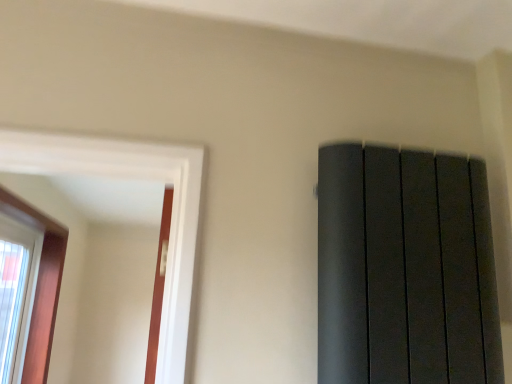
Consider the image. In order to face clear glass window at left, the 2th window positioned from the right, should I rotate leftwards or rightwards?

Rotate left and turn 30.486 degrees.

In order to click on clear glass window at left, the first window when ordered from left to right in this screenshot , I will do `click(16, 293)`.

The width and height of the screenshot is (512, 384). Describe the element at coordinates (16, 293) in the screenshot. I see `clear glass window at left, the first window when ordered from left to right` at that location.

Where is `wooden frame window at left, which ranks as the second window in left-to-right order`? wooden frame window at left, which ranks as the second window in left-to-right order is located at coordinates (41, 287).

What is the approximate width of wooden frame window at left, positioned as the 1th window in right-to-left order?

20.16 centimeters.

This screenshot has height=384, width=512. Describe the element at coordinates (41, 287) in the screenshot. I see `wooden frame window at left, positioned as the 1th window in right-to-left order` at that location.

The height and width of the screenshot is (384, 512). Identify the location of clear glass window at left, the 2th window positioned from the right. (16, 293).

Based on their positions, is clear glass window at left, the first window when ordered from left to right, located to the left or right of wooden frame window at left, positioned as the 1th window in right-to-left order?

In the image, clear glass window at left, the first window when ordered from left to right, appears on the left side of wooden frame window at left, positioned as the 1th window in right-to-left order.

Which is behind, clear glass window at left, the 2th window positioned from the right, or wooden frame window at left, which ranks as the second window in left-to-right order?

Answer: clear glass window at left, the 2th window positioned from the right, is further from the camera.

Considering the positions of point (17, 352) and point (29, 361), is point (17, 352) closer or farther from the camera than point (29, 361)?

Point (17, 352) is closer to the camera than point (29, 361).

From the image's perspective, is clear glass window at left, the 2th window positioned from the right, over wooden frame window at left, positioned as the 1th window in right-to-left order?

A: No, from the image's perspective, clear glass window at left, the 2th window positioned from the right, is not over wooden frame window at left, positioned as the 1th window in right-to-left order.

From a real-world perspective, is clear glass window at left, the 2th window positioned from the right, positioned under wooden frame window at left, which ranks as the second window in left-to-right order, based on gravity?

Yes, from a real-world perspective, clear glass window at left, the 2th window positioned from the right, is beneath wooden frame window at left, which ranks as the second window in left-to-right order.

Considering the sizes of objects clear glass window at left, the first window when ordered from left to right, and wooden frame window at left, positioned as the 1th window in right-to-left order, in the image provided, who is wider, clear glass window at left, the first window when ordered from left to right, or wooden frame window at left, positioned as the 1th window in right-to-left order,?

wooden frame window at left, positioned as the 1th window in right-to-left order, is wider.

Can you confirm if clear glass window at left, the first window when ordered from left to right, is shorter than wooden frame window at left, positioned as the 1th window in right-to-left order?

Correct, clear glass window at left, the first window when ordered from left to right, is not as tall as wooden frame window at left, positioned as the 1th window in right-to-left order.

Is clear glass window at left, the first window when ordered from left to right, bigger or smaller than wooden frame window at left, which ranks as the second window in left-to-right order?

clear glass window at left, the first window when ordered from left to right, is smaller than wooden frame window at left, which ranks as the second window in left-to-right order.

Is clear glass window at left, the 2th window positioned from the right, spatially inside wooden frame window at left, positioned as the 1th window in right-to-left order, or outside of it?

clear glass window at left, the 2th window positioned from the right, cannot be found inside wooden frame window at left, positioned as the 1th window in right-to-left order.

Is clear glass window at left, the first window when ordered from left to right, beside wooden frame window at left, positioned as the 1th window in right-to-left order?

No, clear glass window at left, the first window when ordered from left to right, is not making contact with wooden frame window at left, positioned as the 1th window in right-to-left order.

Is clear glass window at left, the 2th window positioned from the right, looking in the opposite direction of wooden frame window at left, which ranks as the second window in left-to-right order?

Yes, clear glass window at left, the 2th window positioned from the right, is facing away from wooden frame window at left, which ranks as the second window in left-to-right order.

Identify the location of window lying in front of the clear glass window at left, the first window when ordered from left to right. (41, 287).

Which is more to the left, wooden frame window at left, which ranks as the second window in left-to-right order, or clear glass window at left, the first window when ordered from left to right?

From the viewer's perspective, clear glass window at left, the first window when ordered from left to right, appears more on the left side.

Based on the photo, is wooden frame window at left, positioned as the 1th window in right-to-left order, in front of or behind clear glass window at left, the first window when ordered from left to right, in the image?

Visually, wooden frame window at left, positioned as the 1th window in right-to-left order, is located in front of clear glass window at left, the first window when ordered from left to right.

Considering the positions of points (35, 338) and (25, 324), is point (35, 338) closer to camera compared to point (25, 324)?

No, (35, 338) is further to viewer.

From the image's perspective, is wooden frame window at left, which ranks as the second window in left-to-right order, below clear glass window at left, the first window when ordered from left to right?

No, from the image's perspective, wooden frame window at left, which ranks as the second window in left-to-right order, is not below clear glass window at left, the first window when ordered from left to right.

From a real-world perspective, which object rests below the other?

From a 3D spatial view, clear glass window at left, the 2th window positioned from the right, is below.

Does wooden frame window at left, which ranks as the second window in left-to-right order, have a greater width compared to clear glass window at left, the 2th window positioned from the right?

Yes, wooden frame window at left, which ranks as the second window in left-to-right order, is wider than clear glass window at left, the 2th window positioned from the right.

Can you confirm if wooden frame window at left, which ranks as the second window in left-to-right order, is taller than clear glass window at left, the first window when ordered from left to right?

Correct, wooden frame window at left, which ranks as the second window in left-to-right order, is much taller as clear glass window at left, the first window when ordered from left to right.

Looking at this image, considering the relative sizes of wooden frame window at left, positioned as the 1th window in right-to-left order, and clear glass window at left, the 2th window positioned from the right, in the image provided, is wooden frame window at left, positioned as the 1th window in right-to-left order, bigger than clear glass window at left, the 2th window positioned from the right,?

Correct, wooden frame window at left, positioned as the 1th window in right-to-left order, is larger in size than clear glass window at left, the 2th window positioned from the right.

Is wooden frame window at left, which ranks as the second window in left-to-right order, not inside clear glass window at left, the 2th window positioned from the right?

Yes.

Is wooden frame window at left, positioned as the 1th window in right-to-left order, next to clear glass window at left, the first window when ordered from left to right?

No, wooden frame window at left, positioned as the 1th window in right-to-left order, is not next to clear glass window at left, the first window when ordered from left to right.

Is wooden frame window at left, which ranks as the second window in left-to-right order, turned away from clear glass window at left, the first window when ordered from left to right?

Yes, clear glass window at left, the first window when ordered from left to right, is at the back of wooden frame window at left, which ranks as the second window in left-to-right order.

Can you tell me how much wooden frame window at left, positioned as the 1th window in right-to-left order, and clear glass window at left, the 2th window positioned from the right, differ in facing direction?

wooden frame window at left, positioned as the 1th window in right-to-left order, and clear glass window at left, the 2th window positioned from the right, are facing 0.648 degrees away from each other.

Measure the distance from wooden frame window at left, which ranks as the second window in left-to-right order, to clear glass window at left, the 2th window positioned from the right.

The distance of wooden frame window at left, which ranks as the second window in left-to-right order, from clear glass window at left, the 2th window positioned from the right, is 17.19 centimeters.

Where is `window behind the wooden frame window at left, which ranks as the second window in left-to-right order`? window behind the wooden frame window at left, which ranks as the second window in left-to-right order is located at coordinates (16, 293).

Identify the location of window above the clear glass window at left, the first window when ordered from left to right (from a real-world perspective). (41, 287).

Where is `window below the wooden frame window at left, which ranks as the second window in left-to-right order (from the image's perspective)`? The height and width of the screenshot is (384, 512). window below the wooden frame window at left, which ranks as the second window in left-to-right order (from the image's perspective) is located at coordinates click(x=16, y=293).